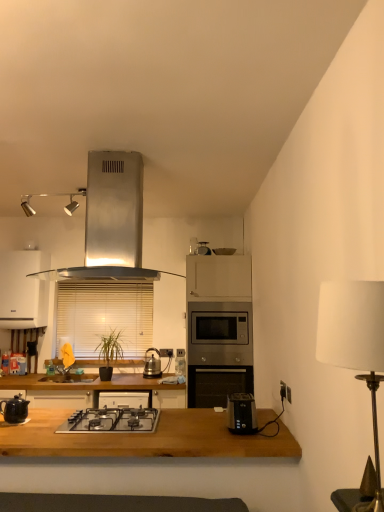
Question: Is wooden table at center positioned beyond the bounds of wooden blinds at center?

Choices:
 (A) no
 (B) yes

Answer: (B)

Question: Considering the relative sizes of wooden table at center and wooden blinds at center in the image provided, is wooden table at center bigger than wooden blinds at center?

Choices:
 (A) yes
 (B) no

Answer: (A)

Question: Does wooden table at center appear on the left side of wooden blinds at center?

Choices:
 (A) no
 (B) yes

Answer: (A)

Question: Is wooden table at center aimed at wooden blinds at center?

Choices:
 (A) yes
 (B) no

Answer: (B)

Question: Does wooden table at center lie in front of wooden blinds at center?

Choices:
 (A) yes
 (B) no

Answer: (A)

Question: Considering the relative sizes of wooden table at center and wooden blinds at center in the image provided, is wooden table at center thinner than wooden blinds at center?

Choices:
 (A) no
 (B) yes

Answer: (A)

Question: Is wooden blinds at center looking in the opposite direction of metallic silver scale at upper center?

Choices:
 (A) yes
 (B) no

Answer: (B)

Question: Considering the relative sizes of wooden blinds at center and metallic silver scale at upper center in the image provided, is wooden blinds at center wider than metallic silver scale at upper center?

Choices:
 (A) yes
 (B) no

Answer: (B)

Question: Does wooden blinds at center lie behind metallic silver scale at upper center?

Choices:
 (A) no
 (B) yes

Answer: (B)

Question: Does wooden blinds at center come in front of metallic silver scale at upper center?

Choices:
 (A) no
 (B) yes

Answer: (A)

Question: From a real-world perspective, does wooden blinds at center stand above metallic silver scale at upper center?

Choices:
 (A) no
 (B) yes

Answer: (A)

Question: Are wooden blinds at center and metallic silver scale at upper center making contact?

Choices:
 (A) no
 (B) yes

Answer: (A)

Question: Considering the relative sizes of black plastic toaster at lower center and wooden blinds at center in the image provided, is black plastic toaster at lower center shorter than wooden blinds at center?

Choices:
 (A) no
 (B) yes

Answer: (B)